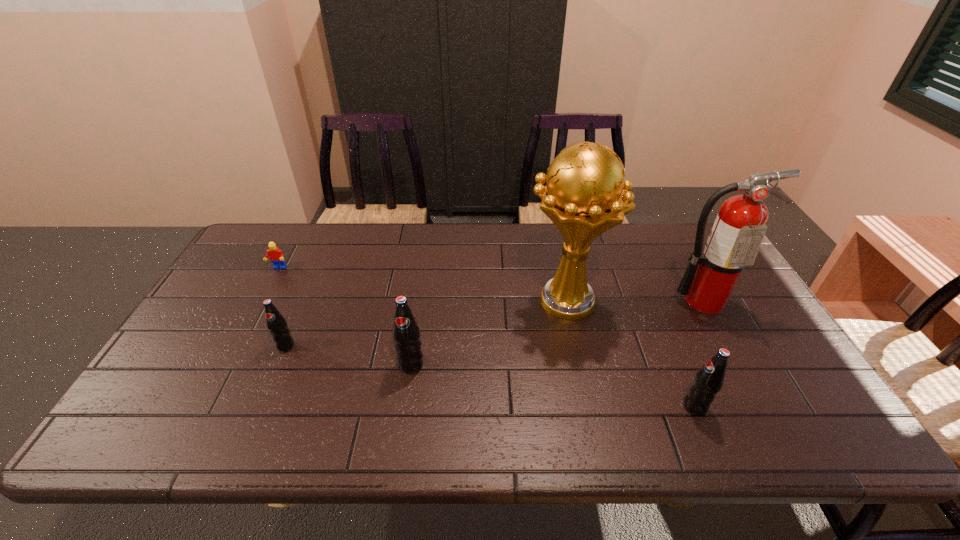
If equal spacing is the goal by inserting an additional pop_(soda) among them, please point out a vacant space for this new pop_(soda). Please provide its 2D coordinates. Your answer should be formatted as a tuple, i.e. [(x, y)], where the tuple contains the x and y coordinates of a point satisfying the conditions above.

[(547, 384)]